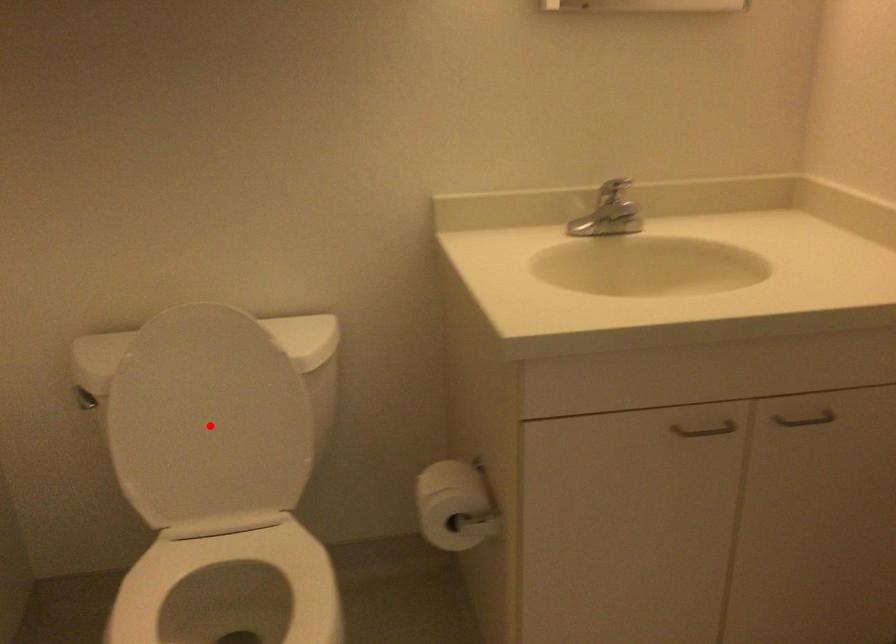
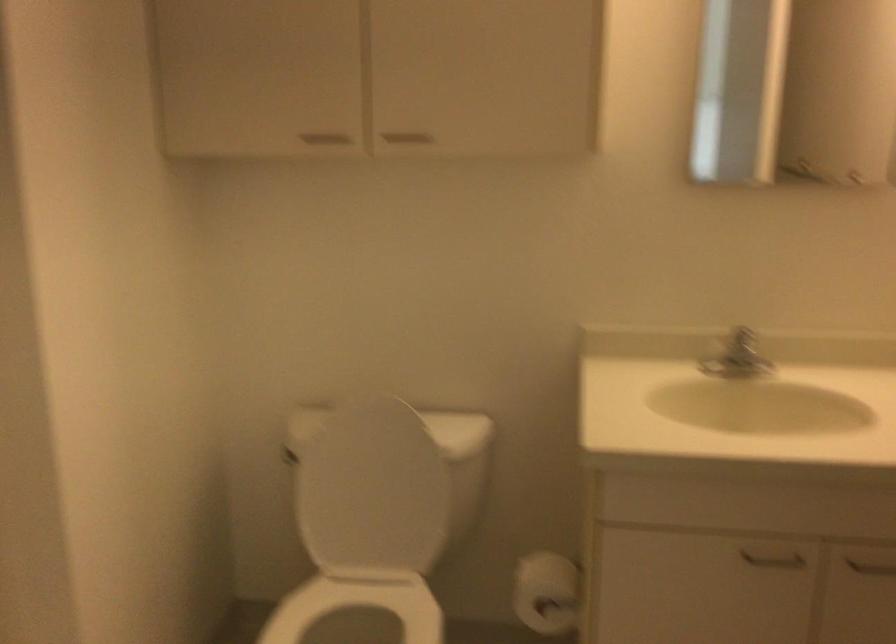
Locate, in the second image, the point that corresponds to the highlighted location in the first image.

(373, 491)